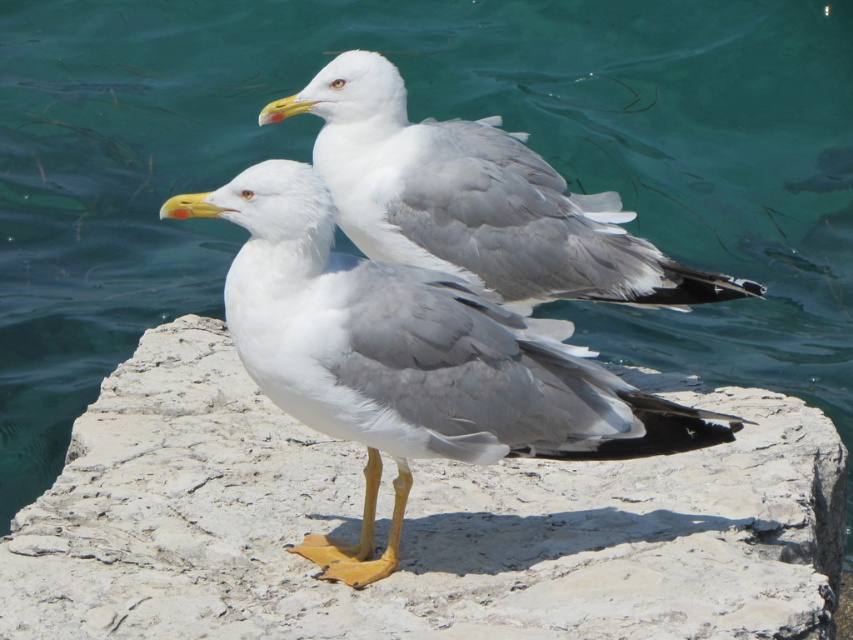
Question: Which of the following is the farthest from the observer?

Choices:
 (A) white stone at center
 (B) white feathered seagull at center

Answer: (A)

Question: Can you confirm if white feathered seagull at center is thinner than white matte seagull at center?

Choices:
 (A) no
 (B) yes

Answer: (B)

Question: Does white feathered seagull at center appear on the right side of white matte seagull at center?

Choices:
 (A) no
 (B) yes

Answer: (A)

Question: Which point appears closest to the camera in this image?

Choices:
 (A) (840, 477)
 (B) (421, 298)
 (C) (759, 296)

Answer: (B)

Question: Which of the following is the farthest from the observer?

Choices:
 (A) white stone at center
 (B) white matte seagull at center

Answer: (B)

Question: Can you confirm if white stone at center is positioned above white matte seagull at center?

Choices:
 (A) yes
 (B) no

Answer: (B)